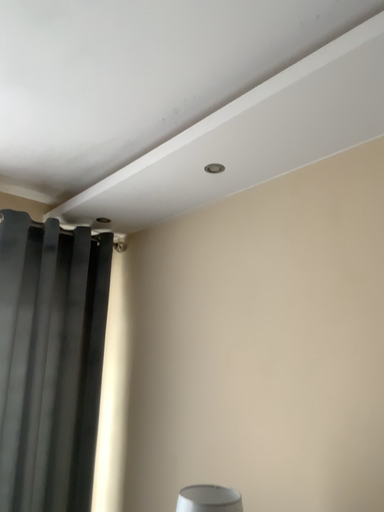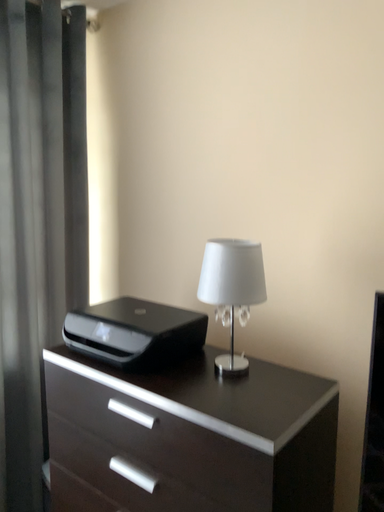
Question: Which way did the camera rotate in the video?

Choices:
 (A) rotated upward
 (B) rotated downward

Answer: (B)